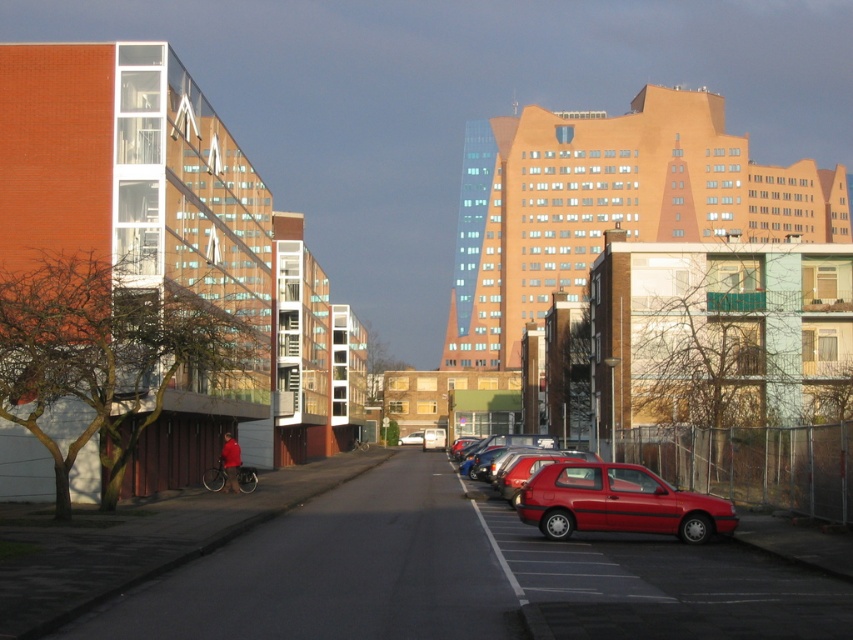
Question: Which of the following is the farthest from the observer?

Choices:
 (A) (550, 531)
 (B) (410, 436)

Answer: (B)

Question: Can you confirm if shiny red hatchback at lower right is positioned below matte red car at center?

Choices:
 (A) no
 (B) yes

Answer: (A)

Question: Can you confirm if shiny red hatchback at lower right is bigger than matte red car at center?

Choices:
 (A) no
 (B) yes

Answer: (A)

Question: Which object is farther from the camera taking this photo?

Choices:
 (A) matte red car at center
 (B) shiny red hatchback at lower right

Answer: (A)

Question: Can you confirm if shiny red hatchback at lower right is positioned to the left of matte red car at center?

Choices:
 (A) yes
 (B) no

Answer: (B)